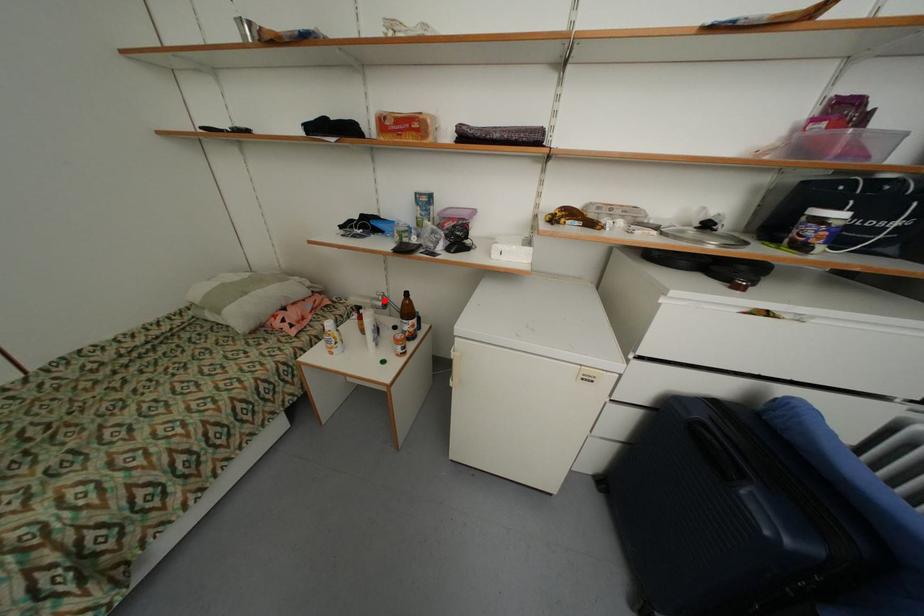
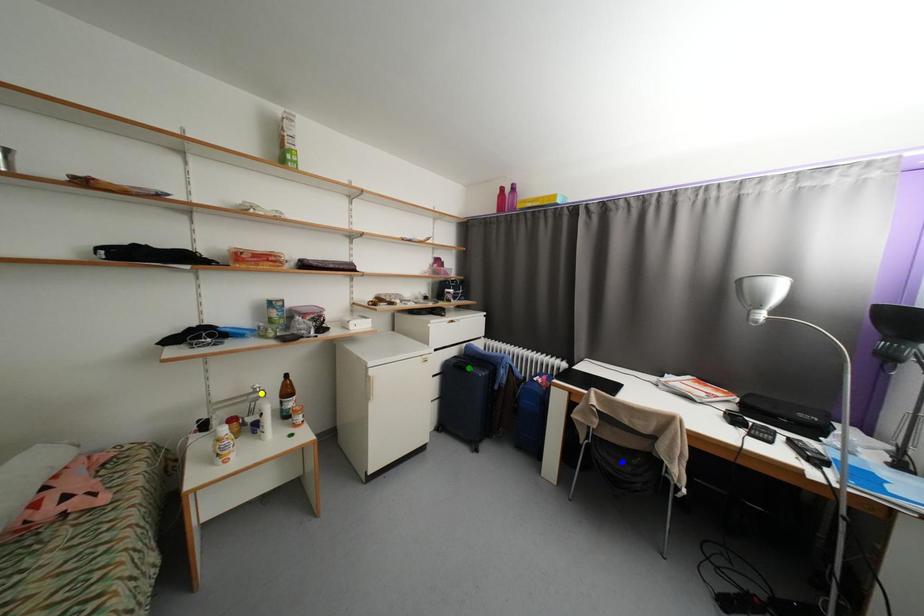
Question: I am providing you with two images of the same scene from different viewpoints. A red point is marked on the first image. You are given multiple points on the second image. In image 2, which mark is for the same physical point as the one in image 1?

Choices:
 (A) green point
 (B) yellow point
 (C) blue point

Answer: (B)